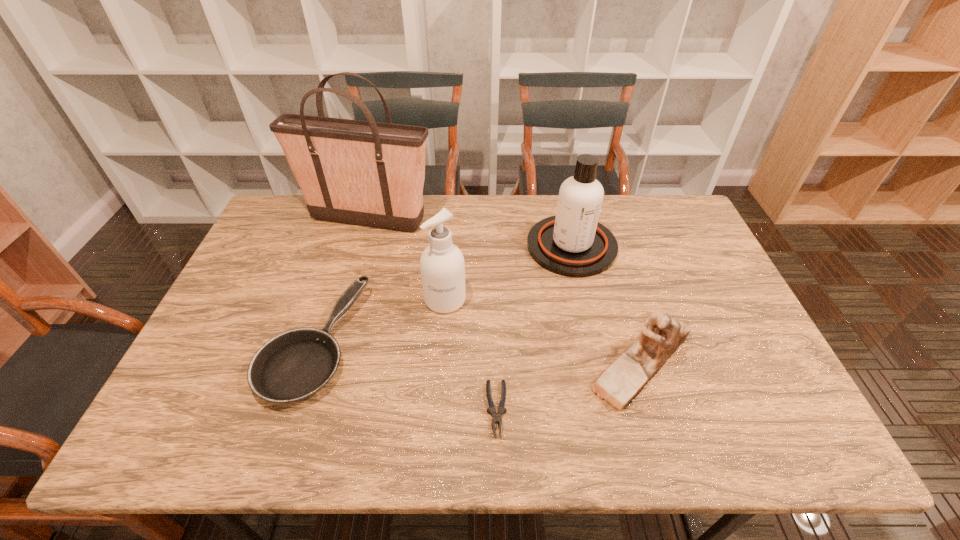
At what (x,y) coordinates should I click in order to perform the action: click on free space located on the front-facing side of the fourth tallest object. Please return your answer as a coordinate pair (x, y). The height and width of the screenshot is (540, 960). Looking at the image, I should click on (469, 363).

What are the coordinates of `vacant position located 0.340m on the front-facing side of the fourth tallest object` in the screenshot? It's located at pyautogui.click(x=449, y=363).

Locate an element on the screen. vacant space located 0.360m on the front-facing side of the fourth tallest object is located at coordinates (442, 363).

Find the location of a particular element. The height and width of the screenshot is (540, 960). vacant space situated 0.150m on the back of the fifth tallest object is located at coordinates (343, 255).

Find the location of a particular element. shopping bag situated at the far edge is located at coordinates (367, 173).

Where is `cleansing agent located at the far edge`? The image size is (960, 540). cleansing agent located at the far edge is located at coordinates (573, 243).

This screenshot has width=960, height=540. Identify the location of object that is at the near edge. (497, 416).

This screenshot has width=960, height=540. In order to click on object that is at the left edge in this screenshot , I will do `click(367, 173)`.

Where is `object at the far left corner`? The image size is (960, 540). object at the far left corner is located at coordinates (367, 173).

What are the coordinates of `vacant area at the near edge` in the screenshot? It's located at coord(361,438).